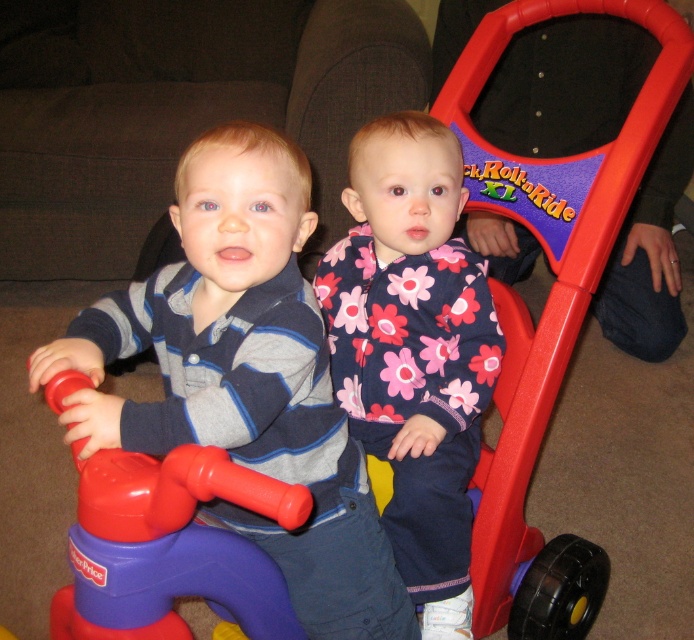
Is matte plastic boy at center to the left of floral fabric jacket at center from the viewer's perspective?

Correct, you'll find matte plastic boy at center to the left of floral fabric jacket at center.

Between point (332, 618) and point (375, 417), which one is positioned behind?

The point (375, 417) is behind.

The image size is (694, 640). Describe the element at coordinates (244, 376) in the screenshot. I see `matte plastic boy at center` at that location.

Find the location of a particular element. matte plastic boy at center is located at coordinates (244, 376).

Is matte plastic boy at center below rubberized plastic toy at center?

Actually, matte plastic boy at center is above rubberized plastic toy at center.

Can you confirm if matte plastic boy at center is bigger than rubberized plastic toy at center?

Yes.

Where is `matte plastic boy at center`? This screenshot has width=694, height=640. matte plastic boy at center is located at coordinates (244, 376).

Can you confirm if floral fabric jacket at center is smaller than rubberized plastic toy at center?

Incorrect, floral fabric jacket at center is not smaller in size than rubberized plastic toy at center.

Based on the photo, measure the distance from floral fabric jacket at center to rubberized plastic toy at center.

14.86 inches

Describe the element at coordinates (414, 349) in the screenshot. I see `floral fabric jacket at center` at that location.

Where is `floral fabric jacket at center`? This screenshot has height=640, width=694. floral fabric jacket at center is located at coordinates (414, 349).